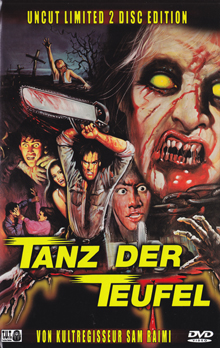
This screenshot has height=348, width=220. I want to click on dvd, so click(198, 333).